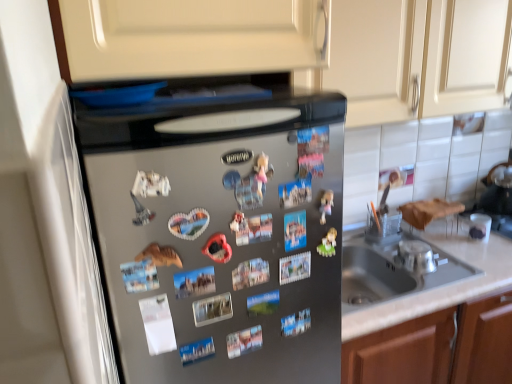
You are a GUI agent. You are given a task and a screenshot of the screen. Output one action in this format:
    pyautogui.click(x=<x>, y=<y>)
    Task: Click on the unoccupied region to the right of silver metallic bowl at sink
    The height and width of the screenshot is (384, 512).
    Given the screenshot: What is the action you would take?
    pyautogui.click(x=463, y=263)